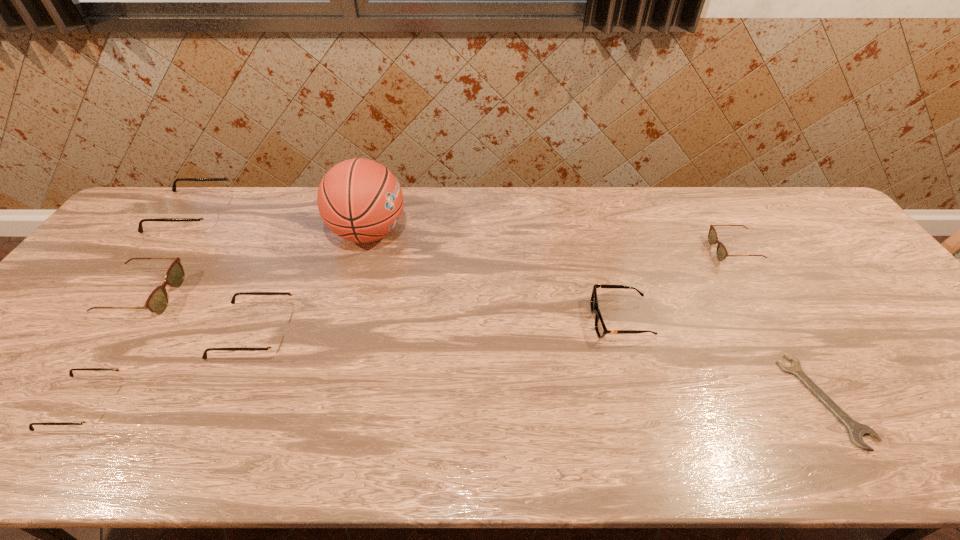
Locate an element on the screen. This screenshot has width=960, height=540. black spectacles object that ranks as the second closest to the fourth spectacles from left to right is located at coordinates (210, 218).

The height and width of the screenshot is (540, 960). I want to click on black spectacles object that ranks as the second closest to the farther brown spectacles, so click(x=210, y=218).